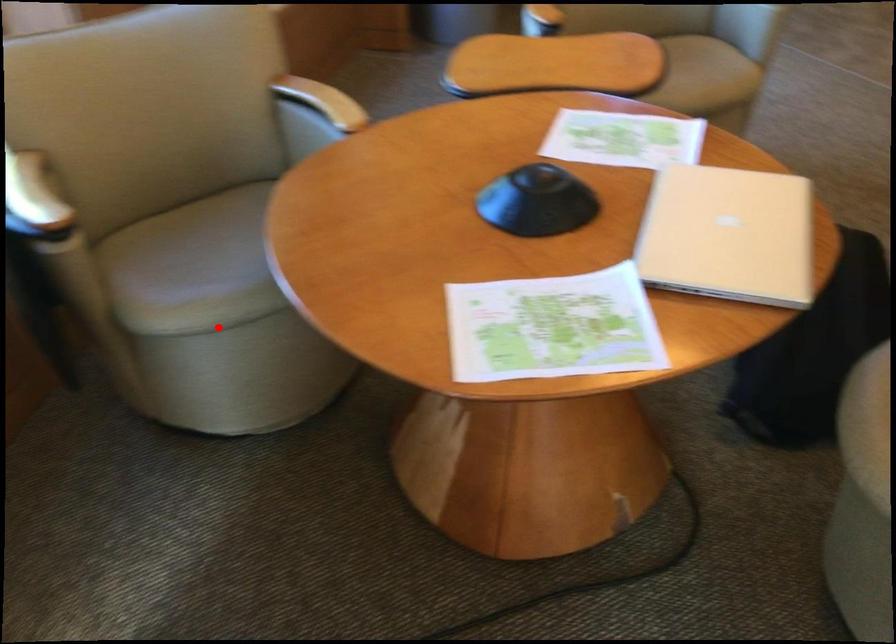
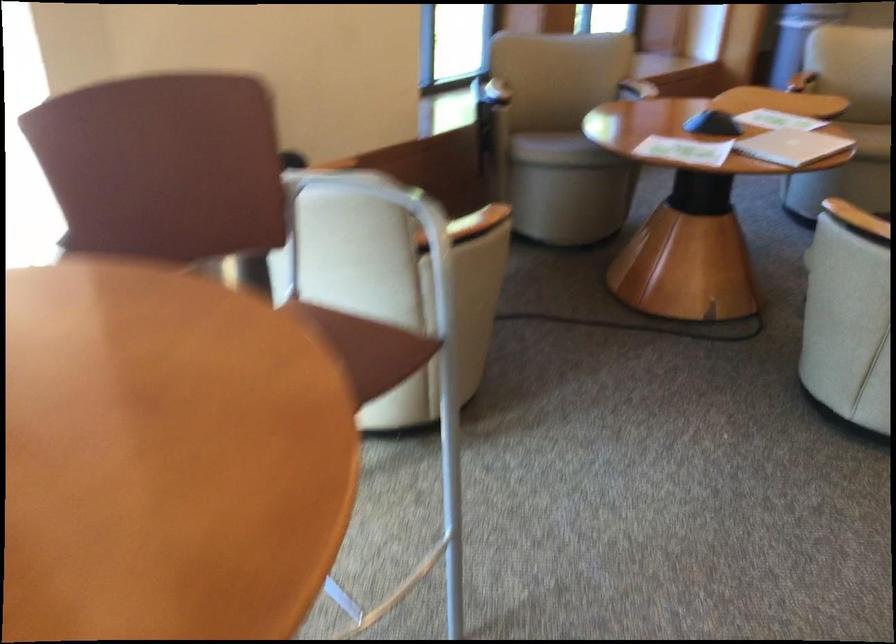
Question: I am providing you with two images of the same scene from different viewpoints. Image1 has a red point marked. In image2, the corresponding 3D location appears at what relative position? Reply with the corresponding letter.

Choices:
 (A) Closer
 (B) Farther

Answer: (B)